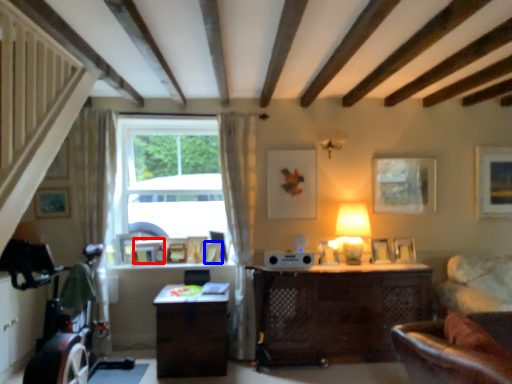
Question: Which object is further to the camera taking this photo, picture frame (highlighted by a red box) or picture frame (highlighted by a blue box)?

Choices:
 (A) picture frame
 (B) picture frame

Answer: (A)